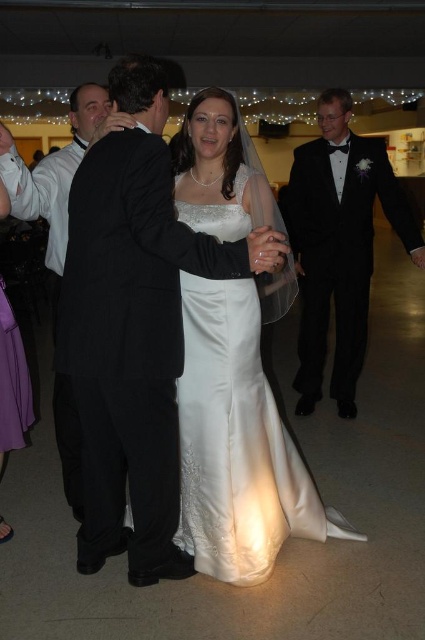
Is satin/sheer white dress at center taller than black satin tuxedo at right?

No.

Which is below, satin/sheer white dress at center or black satin tuxedo at right?

satin/sheer white dress at center

The width and height of the screenshot is (425, 640). What are the coordinates of `satin/sheer white dress at center` in the screenshot? It's located at (238, 444).

I want to click on satin/sheer white dress at center, so click(238, 444).

Is satin/sheer white dress at center smaller than black pinstripe suit at left?

No, satin/sheer white dress at center is not smaller than black pinstripe suit at left.

Is point (229, 509) positioned behind point (99, 108)?

That is False.

At what (x,y) coordinates should I click in order to perform the action: click on satin/sheer white dress at center. Please return your answer as a coordinate pair (x, y). The height and width of the screenshot is (640, 425). Looking at the image, I should click on (238, 444).

From the picture: Is black satin tuxedo at right bigger than black pinstripe suit at left?

Yes, black satin tuxedo at right is bigger than black pinstripe suit at left.

Where is `black satin tuxedo at right`? black satin tuxedo at right is located at coordinates (340, 244).

Find the location of a particular element. The height and width of the screenshot is (640, 425). black satin tuxedo at right is located at coordinates (340, 244).